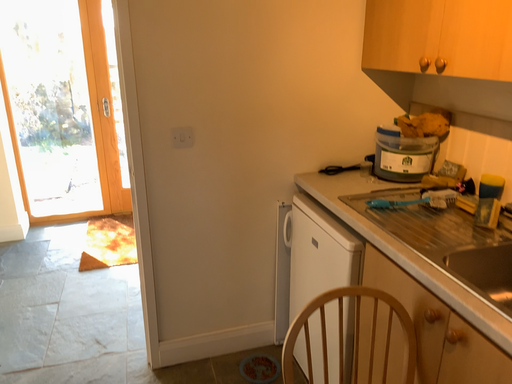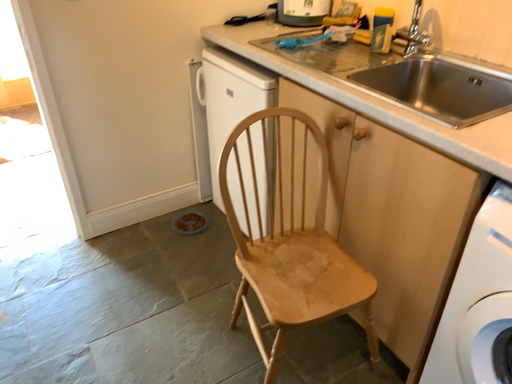
Question: How did the camera likely rotate when shooting the video?

Choices:
 (A) rotated upward
 (B) rotated downward

Answer: (B)